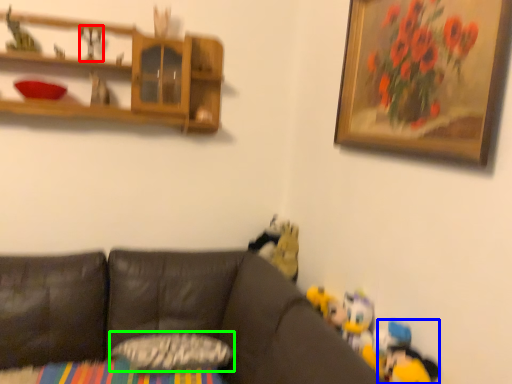
Question: Which object is positioned closest to toy (highlighted by a red box)? Select from toy (highlighted by a blue box) and pillow (highlighted by a green box).

Choices:
 (A) toy
 (B) pillow

Answer: (B)